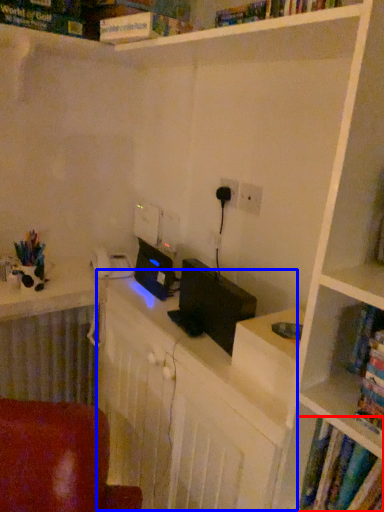
Question: Among these objects, which one is nearest to the camera, book (highlighted by a red box) or computer desk (highlighted by a blue box)?

Choices:
 (A) book
 (B) computer desk

Answer: (A)